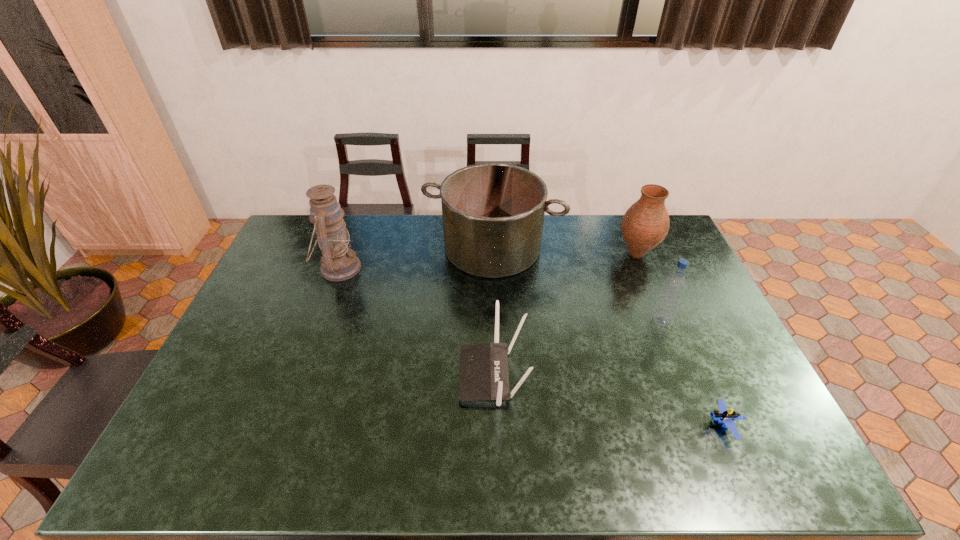
Identify which object is the third closest to the second shortest object. Please provide its 2D coordinates. Your answer should be formatted as a tuple, i.e. [(x, y)], where the tuple contains the x and y coordinates of a point satisfying the conditions above.

[(338, 262)]

Where is `object that ranks as the second closest to the pan`? object that ranks as the second closest to the pan is located at coordinates (338, 262).